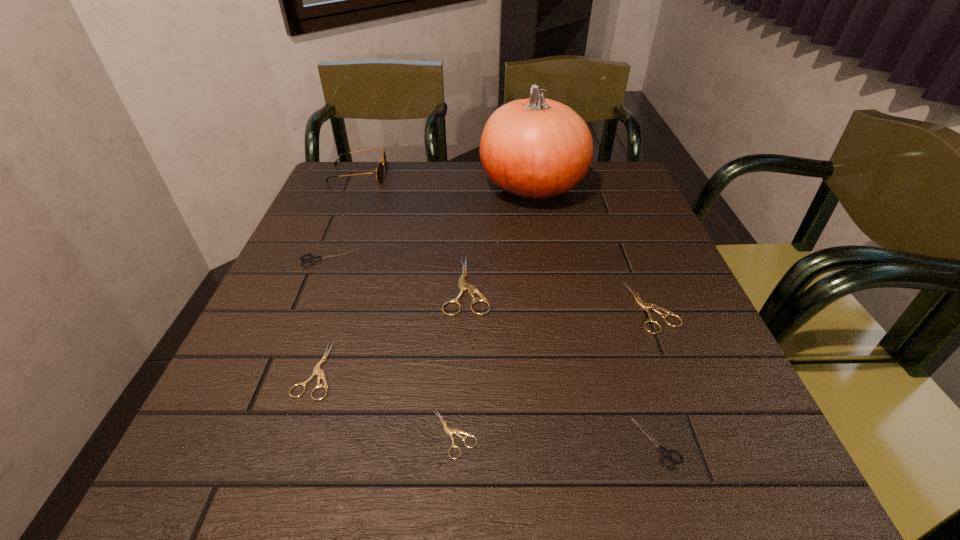
You are a GUI agent. You are given a task and a screenshot of the screen. Output one action in this format:
    pyautogui.click(x=<x>, y=<y>)
    Task: Click on the right black shears
    This screenshot has width=960, height=540.
    Given the screenshot: What is the action you would take?
    pyautogui.click(x=666, y=453)

This screenshot has height=540, width=960. What are the coordinates of `the nearer black shears` in the screenshot? It's located at (666, 453).

What are the coordinates of `the smallest beige shears` in the screenshot? It's located at (449, 431).

You are a GUI agent. You are given a task and a screenshot of the screen. Output one action in this format:
    pyautogui.click(x=<x>, y=<y>)
    Task: Click on the nearest beige shears
    Image resolution: width=960 pixels, height=540 pixels.
    Given the screenshot: What is the action you would take?
    pyautogui.click(x=449, y=431)

The height and width of the screenshot is (540, 960). Identify the location of free space located on the front of the orange pumpkin. (542, 245).

Locate an element on the screen. This screenshot has width=960, height=540. free region located 0.190m on the lenses of the sunglasses is located at coordinates (452, 175).

At what (x,y) coordinates should I click in order to perform the action: click on blank area located on the right of the biggest beige shears. Please return your answer as a coordinate pair (x, y). Looking at the image, I should click on (552, 286).

Locate an element on the screen. This screenshot has width=960, height=540. free spot located 0.120m on the front of the farther black shears is located at coordinates (307, 307).

The width and height of the screenshot is (960, 540). Find the location of `free point located 0.050m on the right of the rightmost beige shears`. free point located 0.050m on the right of the rightmost beige shears is located at coordinates (700, 306).

I want to click on vacant space located 0.380m on the back of the fourth farthest shears, so click(x=366, y=224).